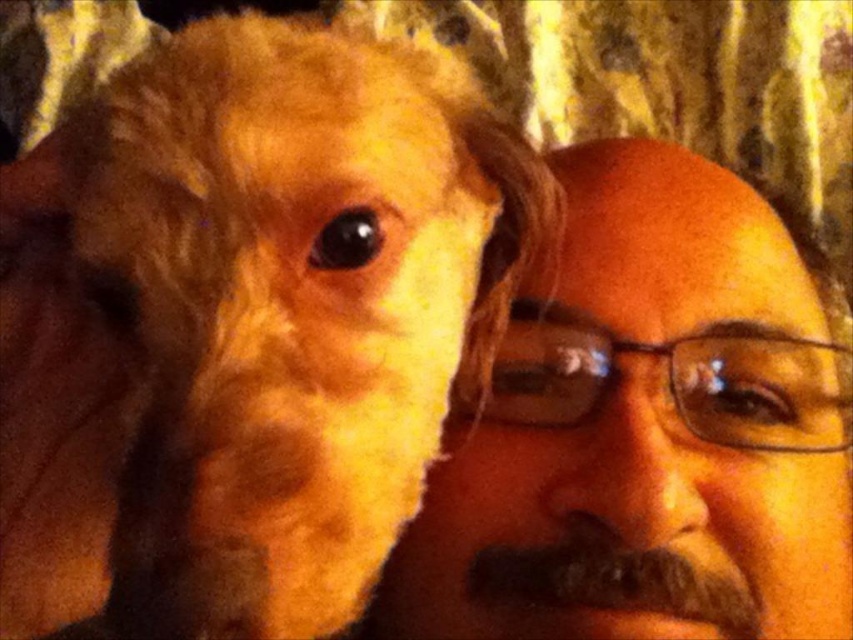
Question: Which of the following is the farthest from the observer?

Choices:
 (A) (402, 397)
 (B) (643, 561)
 (C) (793, 481)

Answer: (C)

Question: Which of the following is the farthest from the observer?

Choices:
 (A) brown fuzzy beard at lower center
 (B) fuzzy golden dog at left
 (C) smooth skin face at center

Answer: (A)

Question: Observing the image, what is the correct spatial positioning of smooth skin face at center in reference to brown fuzzy beard at lower center?

Choices:
 (A) left
 (B) right

Answer: (B)

Question: Does smooth skin face at center have a greater width compared to brown fuzzy beard at lower center?

Choices:
 (A) yes
 (B) no

Answer: (A)

Question: Does fuzzy golden dog at left appear over smooth skin face at center?

Choices:
 (A) no
 (B) yes

Answer: (B)

Question: Among these points, which one is nearest to the camera?

Choices:
 (A) (576, 566)
 (B) (317, 579)
 (C) (541, 358)

Answer: (B)